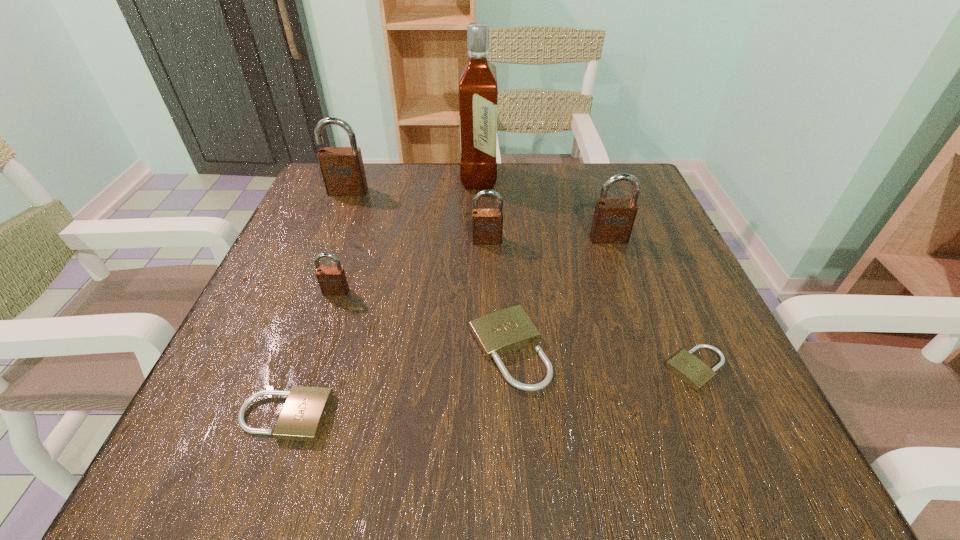
The width and height of the screenshot is (960, 540). Find the location of `the second beige padlock from right to left`. the second beige padlock from right to left is located at coordinates (499, 333).

Where is `the seventh tallest object`? the seventh tallest object is located at coordinates (302, 417).

Image resolution: width=960 pixels, height=540 pixels. Find the location of `the second smallest beige padlock`. the second smallest beige padlock is located at coordinates (302, 417).

Where is `the shortest object`? The height and width of the screenshot is (540, 960). the shortest object is located at coordinates (686, 366).

The height and width of the screenshot is (540, 960). Identify the location of the smallest beige padlock. (686, 366).

In order to click on free region located 0.300m on the front label of the liquor in this screenshot , I will do `click(618, 178)`.

I want to click on free region located on the front-facing side of the farthest brown padlock, so click(319, 265).

The height and width of the screenshot is (540, 960). Identify the location of vacant space positioned on the front-facing side of the rightmost brown padlock. (616, 260).

In order to click on free spot located 0.210m on the front-facing side of the third brown padlock from left to right in this screenshot , I will do `click(489, 323)`.

Where is `vacant space situated 0.300m on the front-facing side of the nearest brown padlock`? The image size is (960, 540). vacant space situated 0.300m on the front-facing side of the nearest brown padlock is located at coordinates (278, 462).